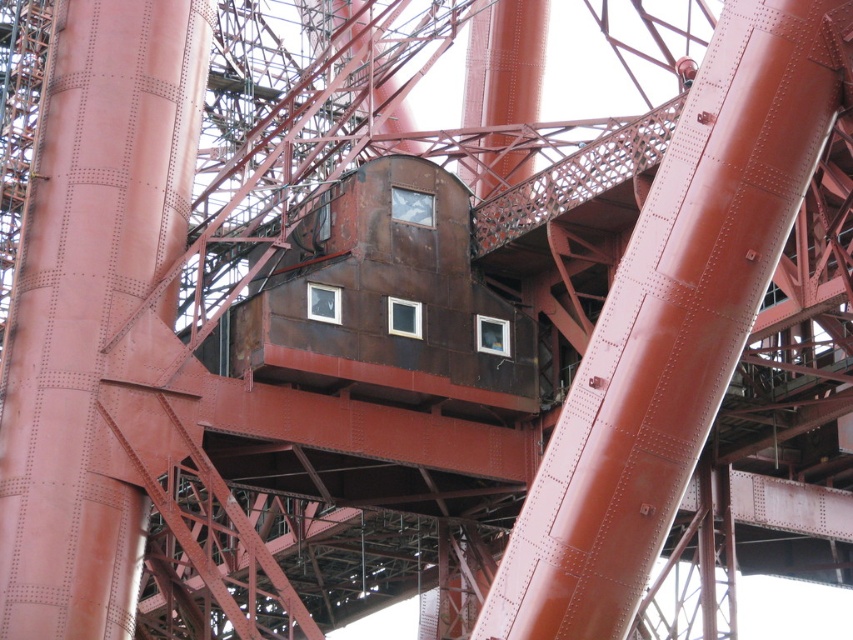
Question: Where is rusty metal pole at center located in relation to rusty metal tower at center in the image?

Choices:
 (A) above
 (B) below

Answer: (B)

Question: Is rusty metal pole at center positioned at the back of rusty metal tower at center?

Choices:
 (A) yes
 (B) no

Answer: (B)

Question: Among these objects, which one is farthest from the camera?

Choices:
 (A) rusty metal pole at center
 (B) rusty metal tower at center

Answer: (B)

Question: Is rusty metal pole at center positioned before rusty metal tower at center?

Choices:
 (A) yes
 (B) no

Answer: (A)

Question: Which point is closer to the camera?

Choices:
 (A) rusty metal tower at center
 (B) rusty metal pole at center

Answer: (B)